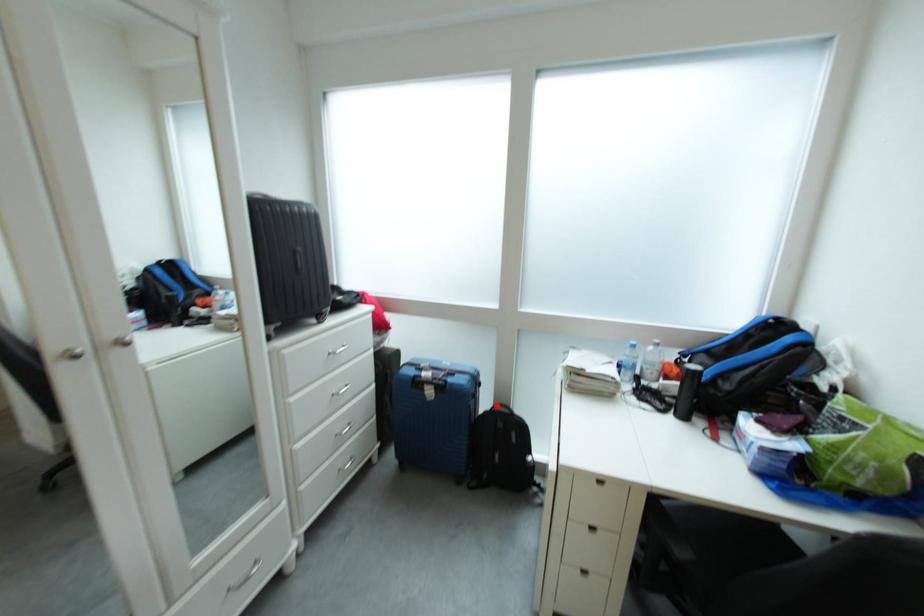
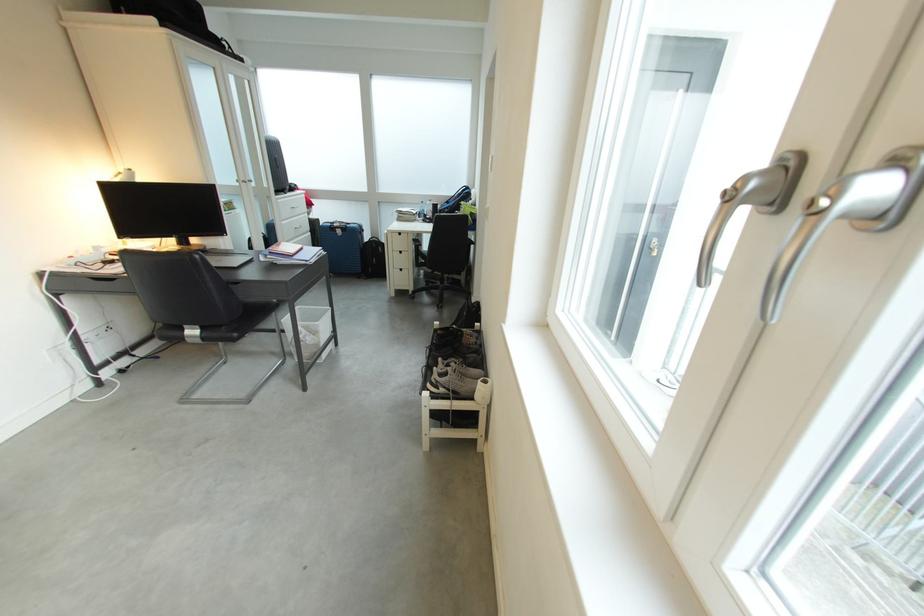
Locate, in the second image, the point that corresponds to the highlighted location in the first image.

(379, 243)